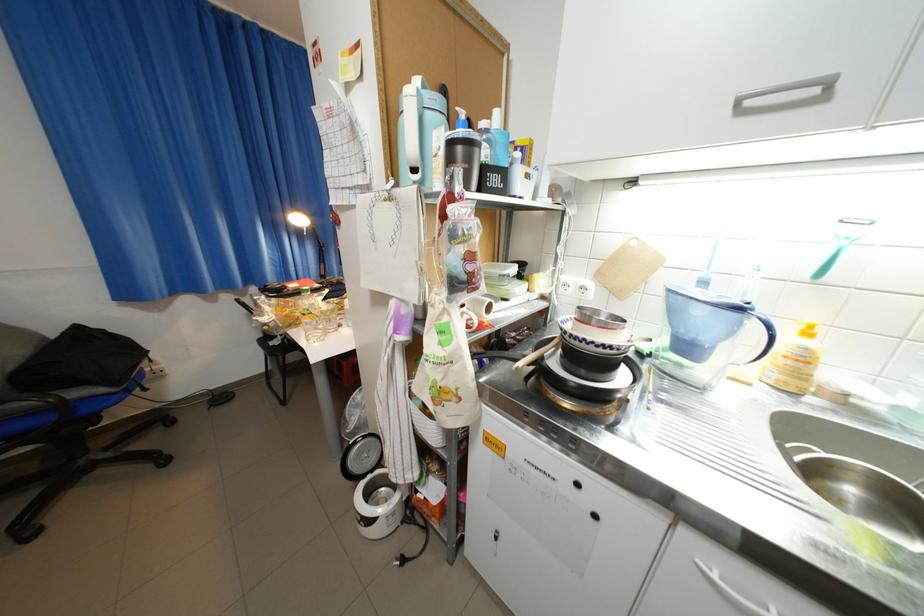
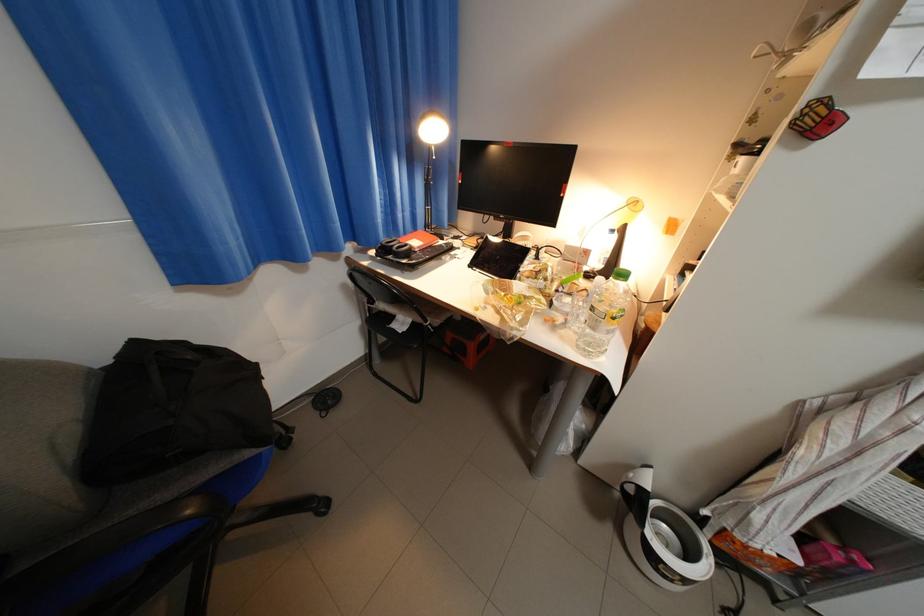
In the second image, find the point that corresponds to [88,329] in the first image.

(147, 344)